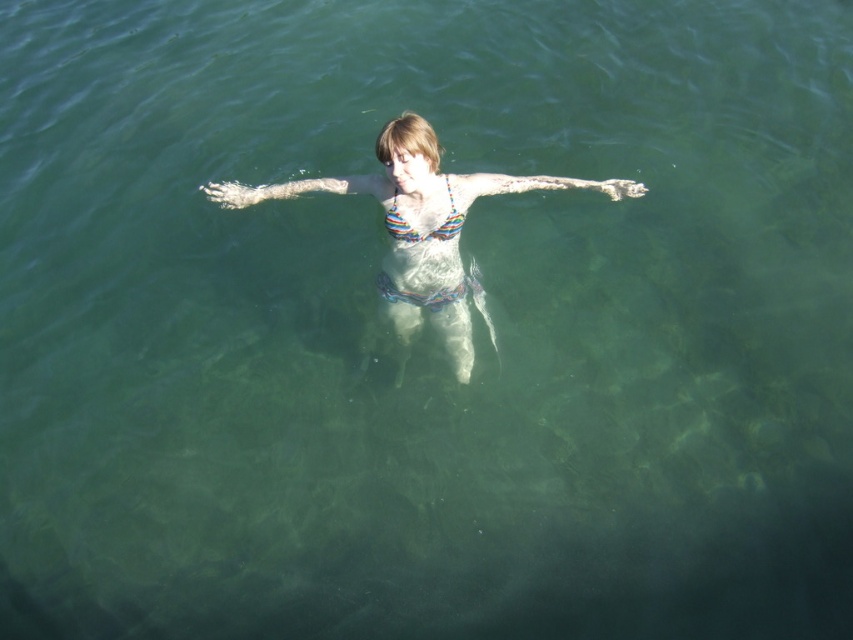
Who is higher up, multicolored bikini at center or rainbow striped bikini top at center?

rainbow striped bikini top at center is above.

Can you confirm if multicolored bikini at center is shorter than rainbow striped bikini top at center?

No.

Does point (389, 282) come farther from viewer compared to point (426, 236)?

That is True.

Where is `multicolored bikini at center`? The image size is (853, 640). multicolored bikini at center is located at coordinates (415, 179).

Is multicolored bikini at center bigger than white matte skin at center?

Yes.

Is multicolored bikini at center smaller than white matte skin at center?

No.

Where is `multicolored bikini at center`? multicolored bikini at center is located at coordinates (415, 179).

Is point (242, 196) positioned after point (462, 218)?

Yes, point (242, 196) is farther from viewer.

Is white matte skin at center further to camera compared to rainbow striped bikini top at center?

Yes, it is.

Which is in front, point (302, 186) or point (392, 224)?

Point (392, 224) is more forward.

In order to click on white matte skin at center in this screenshot , I will do `click(293, 189)`.